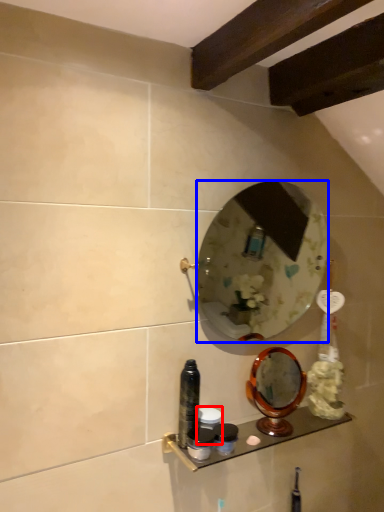
Question: Which of the following is the closest to the observer, toiletry (highlighted by a red box) or mirror (highlighted by a blue box)?

Choices:
 (A) toiletry
 (B) mirror

Answer: (B)